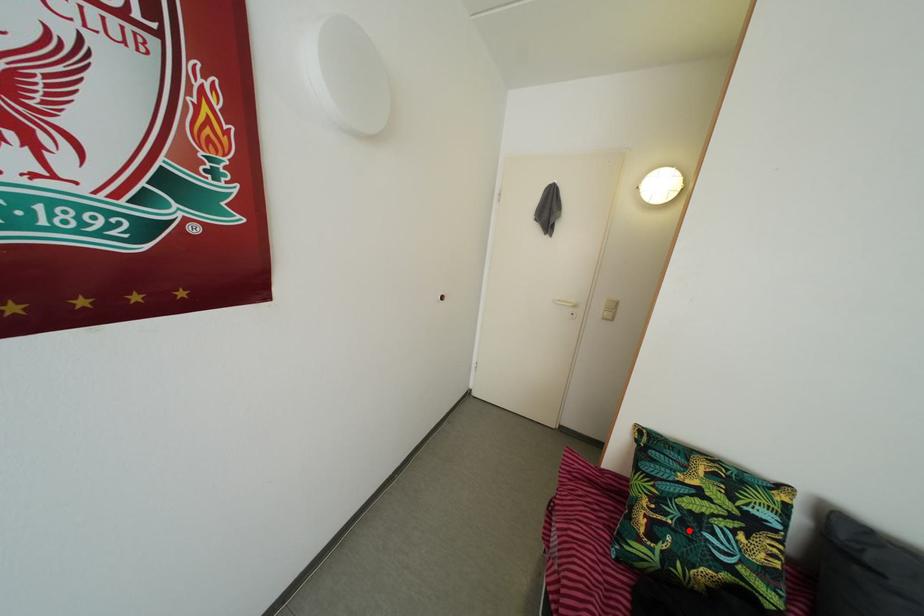
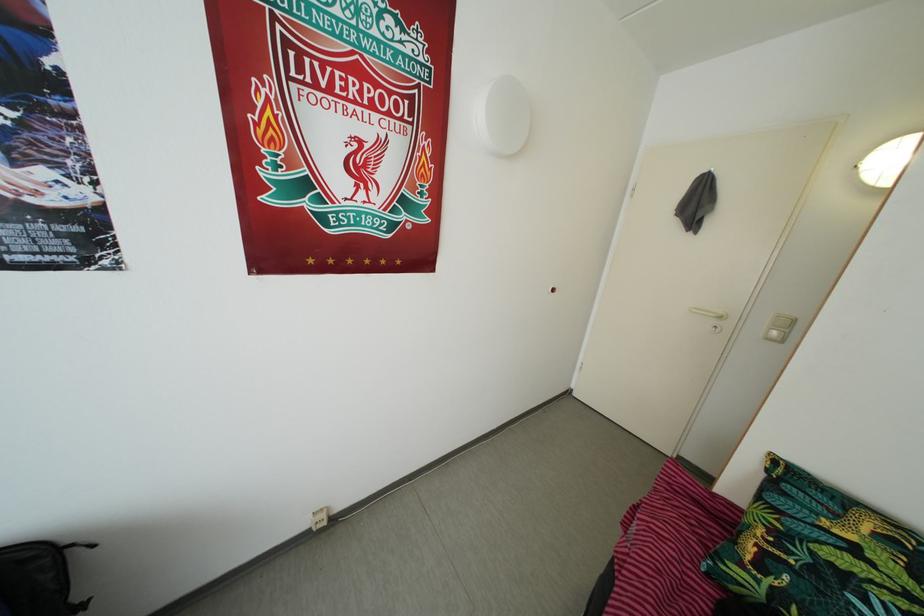
Locate, in the second image, the point that corresponds to the highlighted location in the first image.

(820, 578)